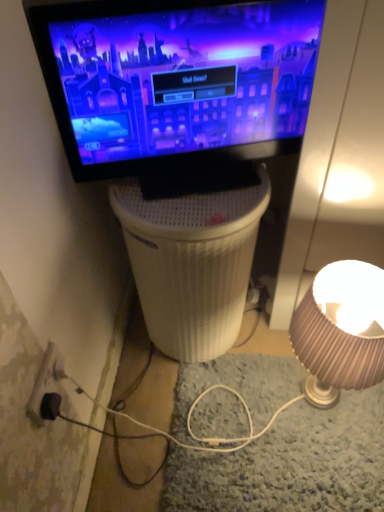
Question: From the image's perspective, is white ribbed plastic at center on matte beige lampshade at right?

Choices:
 (A) no
 (B) yes

Answer: (B)

Question: Is matte beige lampshade at right at the back of white ribbed plastic at center?

Choices:
 (A) no
 (B) yes

Answer: (A)

Question: Considering the relative positions of white ribbed plastic at center and matte beige lampshade at right in the image provided, is white ribbed plastic at center to the left of matte beige lampshade at right from the viewer's perspective?

Choices:
 (A) no
 (B) yes

Answer: (B)

Question: From the image's perspective, is white ribbed plastic at center beneath matte beige lampshade at right?

Choices:
 (A) no
 (B) yes

Answer: (A)

Question: Is white ribbed plastic at center outside of matte beige lampshade at right?

Choices:
 (A) yes
 (B) no

Answer: (A)

Question: Is white ribbed plastic at center beside matte beige lampshade at right?

Choices:
 (A) no
 (B) yes

Answer: (A)

Question: Does black plastic power outlet at lower left appear on the left side of matte black monitor at upper center?

Choices:
 (A) no
 (B) yes

Answer: (B)

Question: Is black plastic power outlet at lower left behind matte black monitor at upper center?

Choices:
 (A) no
 (B) yes

Answer: (B)

Question: Does black plastic power outlet at lower left have a greater height compared to matte black monitor at upper center?

Choices:
 (A) yes
 (B) no

Answer: (B)

Question: From a real-world perspective, is black plastic power outlet at lower left physically above matte black monitor at upper center?

Choices:
 (A) no
 (B) yes

Answer: (A)

Question: Is black plastic power outlet at lower left closer to camera compared to matte black monitor at upper center?

Choices:
 (A) yes
 (B) no

Answer: (B)

Question: Can you confirm if black plastic power outlet at lower left is thinner than matte black monitor at upper center?

Choices:
 (A) yes
 (B) no

Answer: (A)

Question: Considering the relative positions of black plastic power outlet at lower left and matte beige lampshade at right in the image provided, is black plastic power outlet at lower left behind matte beige lampshade at right?

Choices:
 (A) yes
 (B) no

Answer: (B)